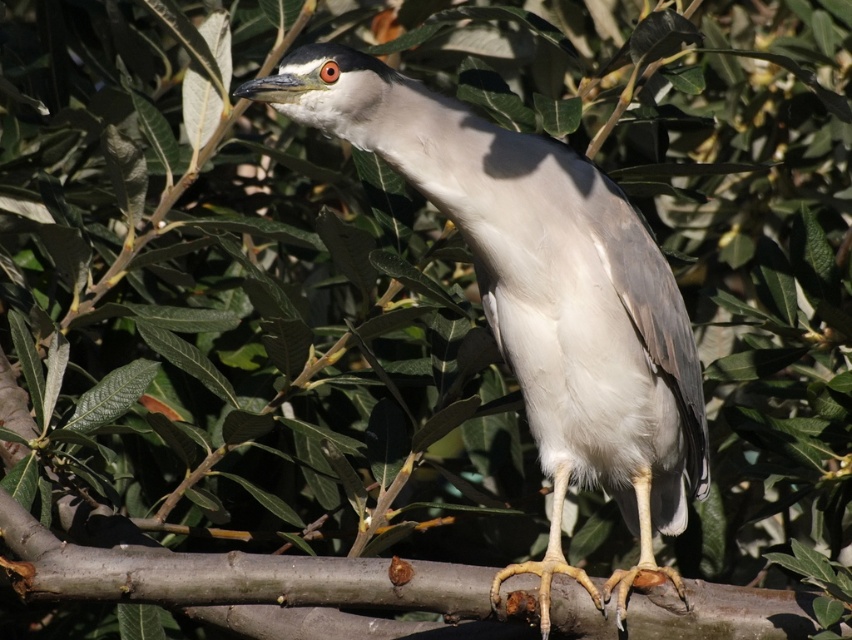
You are standing in a garden and see the white matte bird at center. If you want to take a photo of it without moving closer than 5 feet, will you be able to get a clear shot from your current position?

The white matte bird at center is 5.94 feet away from the viewer. Since 5.94 feet is more than 5 feet, you can take a clear photo without moving closer than 5 feet.

You are an ornithologist observing a Black crowned night heron in its natural habitat. You notice a point marked at coordinates [540,294]. Based on the scene description provided, what object does this point likely correspond to?

The point at coordinates [540,294] corresponds to the white matte bird at center.

You are observing the Black crowned night heron in the image. There are two points marked in the scene. The first point is at coordinate point (473, 186) and the second is at point (72, 506). Which point is closer to your viewpoint?

Point (473, 186) is closer to the camera than point (72, 506).